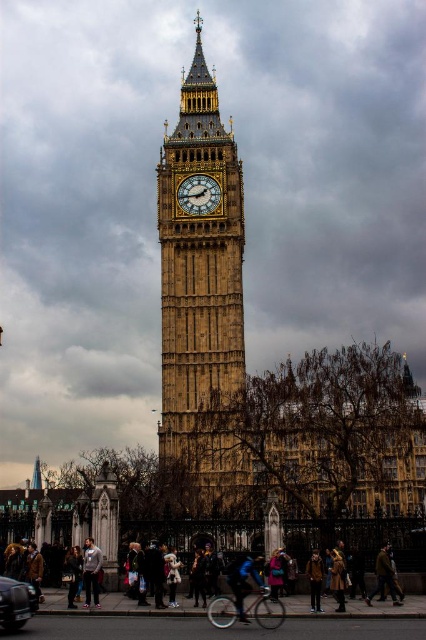
Where is `dark blue jacket at lower center`? Image resolution: width=426 pixels, height=640 pixels. dark blue jacket at lower center is located at coordinates (115, 608).

Measure the distance between dark blue jacket at lower center and camera.

dark blue jacket at lower center is 289.75 feet from camera.

Is point (123, 609) less distant than point (92, 547)?

Yes, it is.

Locate an element on the screen. This screenshot has height=640, width=426. dark blue jacket at lower center is located at coordinates (115, 608).

Does golden stone clock tower at center have a larger size compared to blue fabric jacket at center?

Yes.

Where is `golden stone clock tower at center`? The height and width of the screenshot is (640, 426). golden stone clock tower at center is located at coordinates (201, 308).

What are the coordinates of `golden stone clock tower at center` in the screenshot? It's located at (201, 308).

Is dark blue jacket at lower center behind shiny black car at lower left?

Yes, dark blue jacket at lower center is behind shiny black car at lower left.

The width and height of the screenshot is (426, 640). Describe the element at coordinates (115, 608) in the screenshot. I see `dark blue jacket at lower center` at that location.

Who is more forward, (230,612) or (16,602)?

Point (16,602)

The height and width of the screenshot is (640, 426). I want to click on dark blue jacket at lower center, so [x=115, y=608].